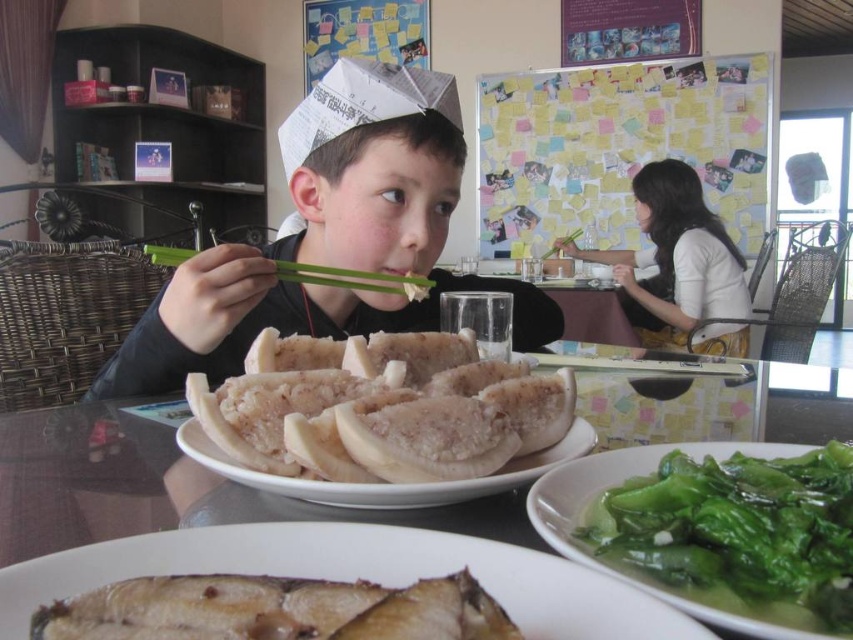
Based on the photo, you are a guest at this dining table and want to reach both the point at [666,72] and the point at [376,616]. Which one will you need to reach for first if you are moving towards the table?

You will need to reach for the point at [666,72] first because it is closer to you than the point at [376,616], which is further away.